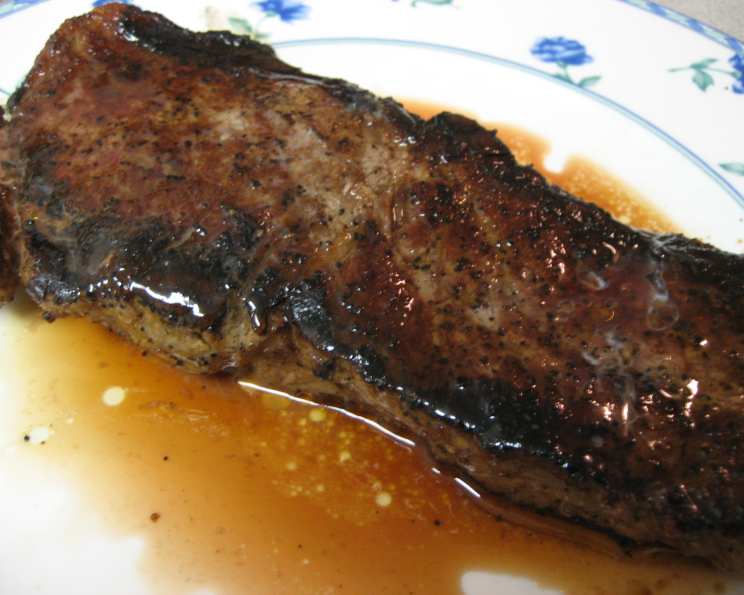
The image size is (744, 595). Identify the location of blue flower design on plate. (559, 54), (705, 65), (280, 6), (103, 0).